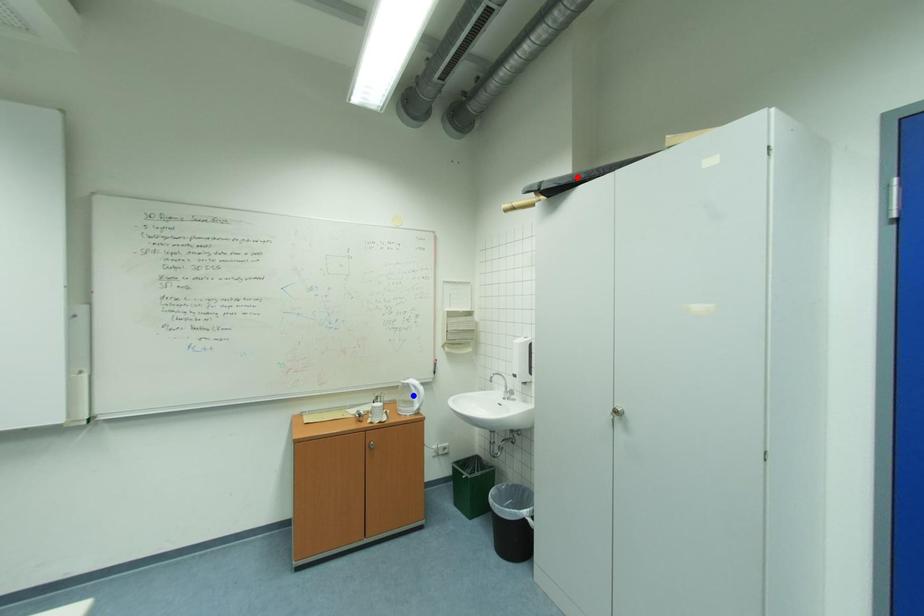
Question: In the image, two points are highlighted. Which point is nearer to the camera? Reply with the corresponding letter.

Choices:
 (A) blue point
 (B) red point

Answer: (B)